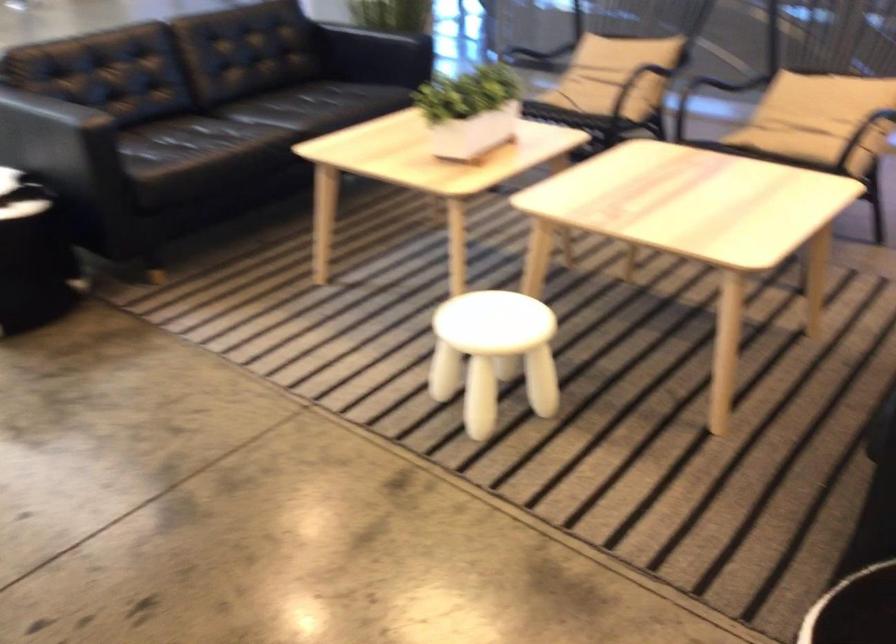
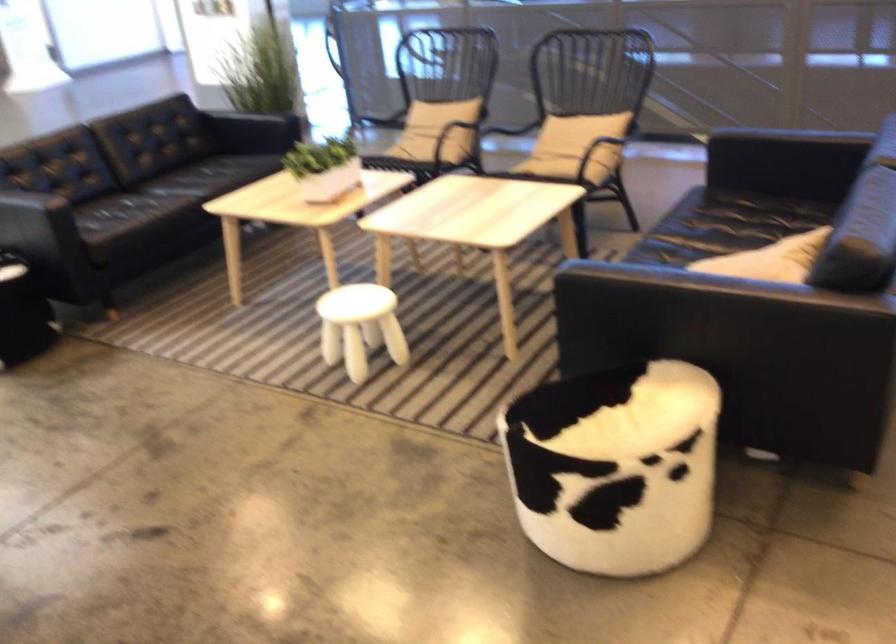
Question: The images are taken continuously from a first-person perspective. In which direction are you moving?

Choices:
 (A) Left
 (B) Right
 (C) Forward
 (D) Backward

Answer: (D)